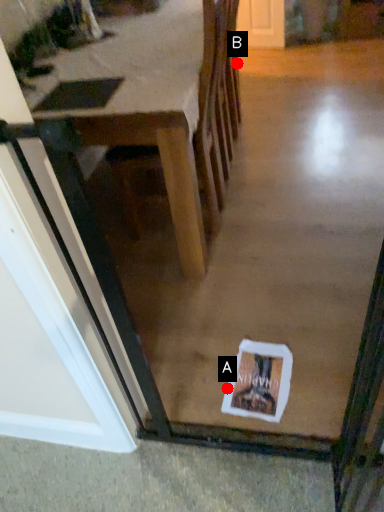
Question: Two points are circled on the image, labeled by A and B beside each circle. Among these points, which one is nearest to the camera?

Choices:
 (A) A is closer
 (B) B is closer

Answer: (A)